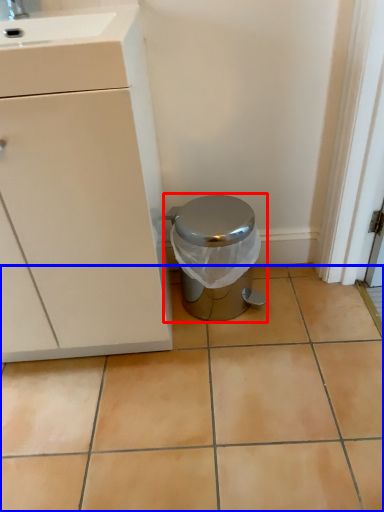
Question: Which of the following is the closest to the observer, waste container (highlighted by a red box) or ceramic tile (highlighted by a blue box)?

Choices:
 (A) waste container
 (B) ceramic tile

Answer: (B)